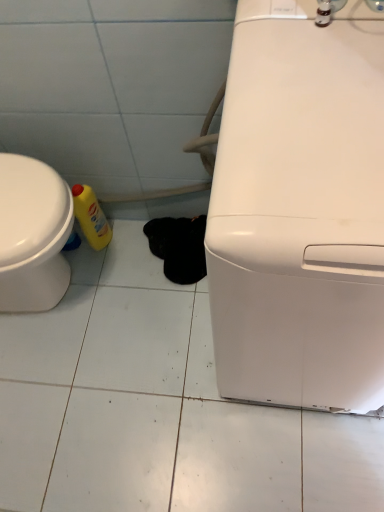
Question: From a real-world perspective, is white glossy washing machine at right physically located above or below yellow plastic bottle at lower left?

Choices:
 (A) below
 (B) above

Answer: (B)

Question: From the image's perspective, relative to yellow plastic bottle at lower left, is white glossy washing machine at right above or below?

Choices:
 (A) above
 (B) below

Answer: (B)

Question: Is white glossy washing machine at right wider or thinner than yellow plastic bottle at lower left?

Choices:
 (A) wide
 (B) thin

Answer: (A)

Question: Looking at the image, does yellow plastic bottle at lower left seem bigger or smaller compared to white glossy washing machine at right?

Choices:
 (A) small
 (B) big

Answer: (A)

Question: From their relative heights in the image, would you say yellow plastic bottle at lower left is taller or shorter than white glossy washing machine at right?

Choices:
 (A) short
 (B) tall

Answer: (A)

Question: Is yellow plastic bottle at lower left wider or thinner than white glossy washing machine at right?

Choices:
 (A) wide
 (B) thin

Answer: (B)

Question: Based on their positions, is yellow plastic bottle at lower left located to the left or right of white glossy washing machine at right?

Choices:
 (A) left
 (B) right

Answer: (A)